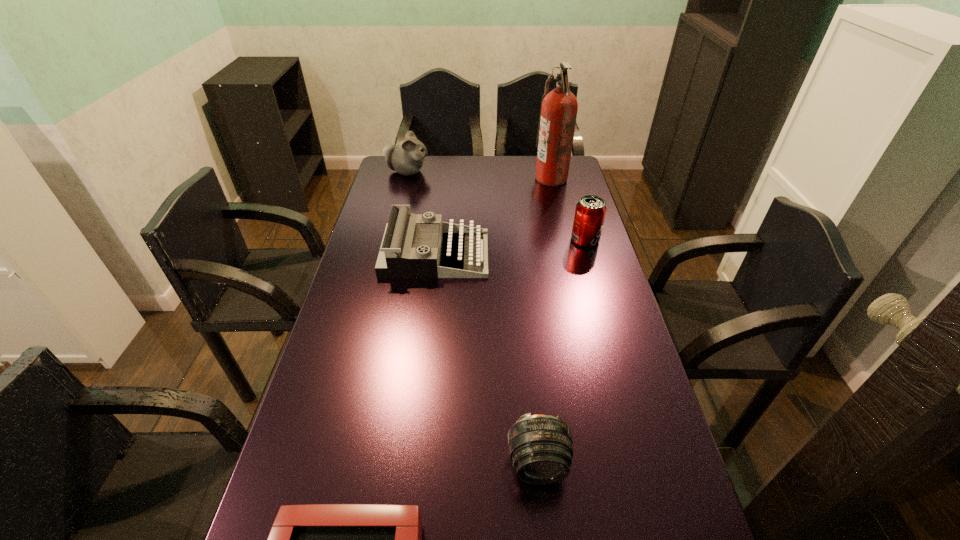
What are the coordinates of `blank area located on the back of the soda can` in the screenshot? It's located at (568, 183).

You are a GUI agent. You are given a task and a screenshot of the screen. Output one action in this format:
    pyautogui.click(x=<x>, y=<y>)
    Task: Click on the vacant space located at the front element of the third object from right to left
    The height and width of the screenshot is (540, 960).
    Given the screenshot: What is the action you would take?
    pyautogui.click(x=543, y=514)

Where is `vacant area located 0.140m on the typing side of the taller typewriter`? This screenshot has height=540, width=960. vacant area located 0.140m on the typing side of the taller typewriter is located at coordinates click(530, 254).

At what (x,y) coordinates should I click in order to perform the action: click on fire extinguisher located at the far edge. Please return your answer as a coordinate pair (x, y). This screenshot has height=540, width=960. Looking at the image, I should click on (558, 111).

Locate an element on the screen. Image resolution: width=960 pixels, height=540 pixels. hamster located at the far edge is located at coordinates (407, 158).

In order to click on hamster present at the left edge in this screenshot , I will do `click(407, 158)`.

Where is `typewriter positioned at the left edge`? Image resolution: width=960 pixels, height=540 pixels. typewriter positioned at the left edge is located at coordinates (397, 258).

The image size is (960, 540). What are the coordinates of `fire extinguisher positioned at the right edge` in the screenshot? It's located at (558, 111).

Where is `soda can present at the right edge`? soda can present at the right edge is located at coordinates pyautogui.click(x=590, y=211).

Identify the location of object at the far left corner. The height and width of the screenshot is (540, 960). (407, 158).